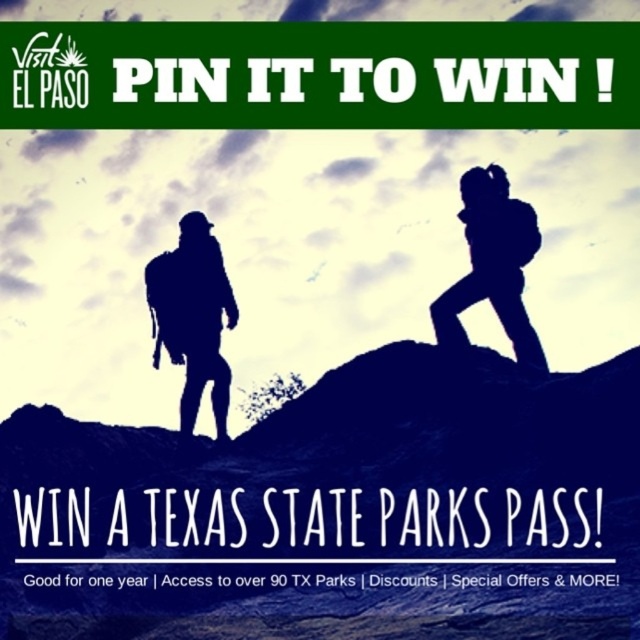
Question: Is the position of black matte backpack at center less distant than that of silhouette backpack at center?

Choices:
 (A) yes
 (B) no

Answer: (B)

Question: Is black matte backpack at center bigger than silhouette backpack at center?

Choices:
 (A) yes
 (B) no

Answer: (B)

Question: Which point is farther to the camera?

Choices:
 (A) (499, 248)
 (B) (186, 273)

Answer: (A)

Question: Which object is closer to the camera taking this photo?

Choices:
 (A) black matte backpack at center
 (B) silhouette backpack at center

Answer: (B)

Question: Can you confirm if black matte backpack at center is positioned below silhouette backpack at center?

Choices:
 (A) no
 (B) yes

Answer: (B)